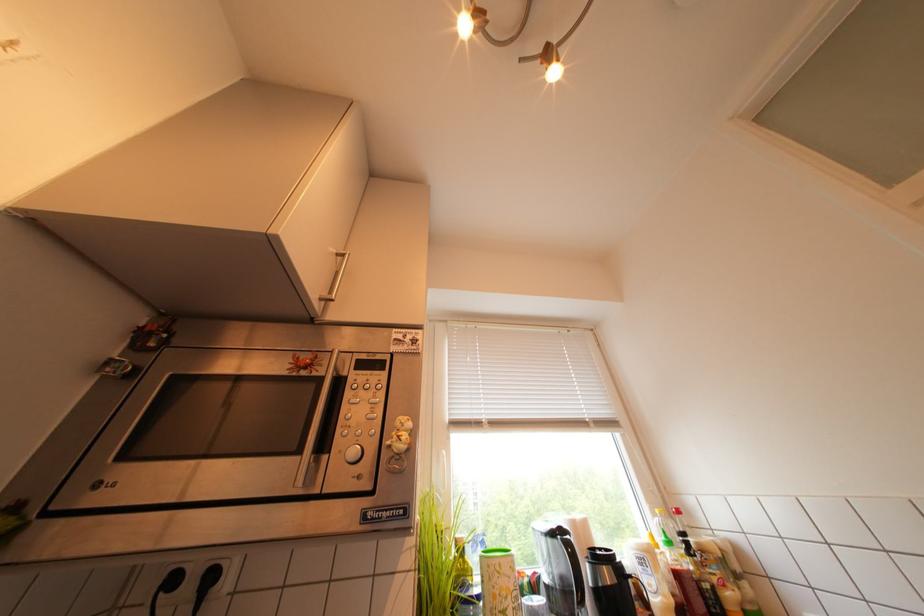
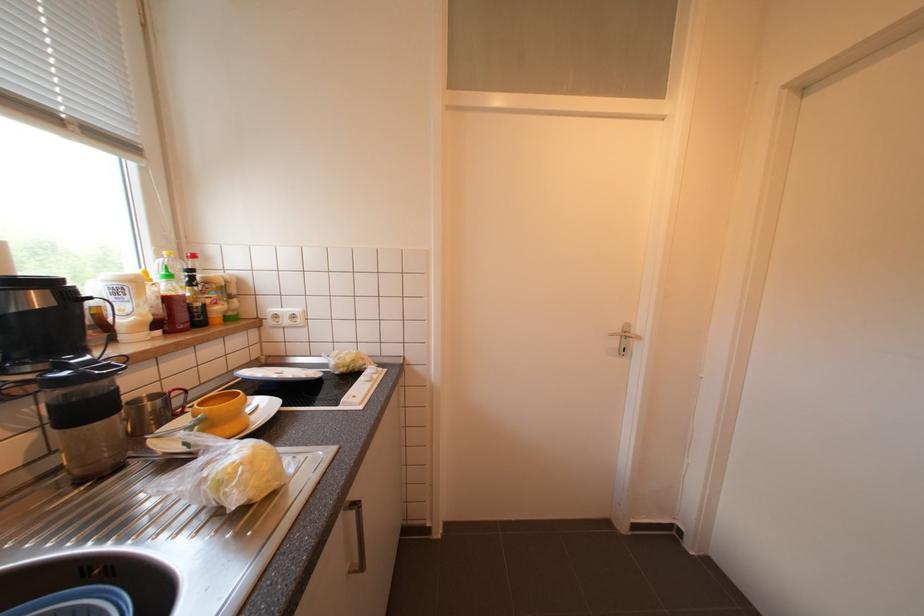
Question: How did the camera likely rotate?

Choices:
 (A) Left
 (B) Right
 (C) Up
 (D) Down

Answer: (B)